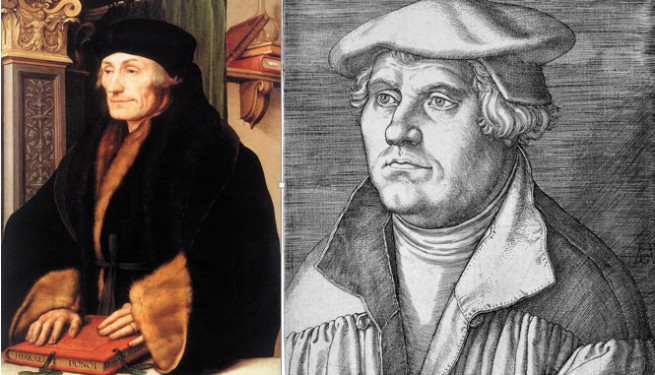
Where is `shelf`? shelf is located at coordinates (233, 99).